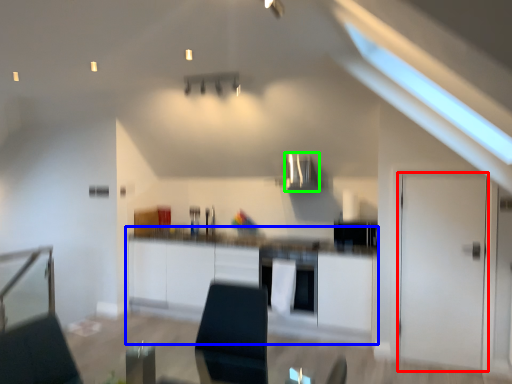
Question: Estimate the real-world distances between objects in this image. Which object is farther from door (highlighted by a red box), cabinetry (highlighted by a blue box) or exhaust hood (highlighted by a green box)?

Choices:
 (A) cabinetry
 (B) exhaust hood

Answer: (B)